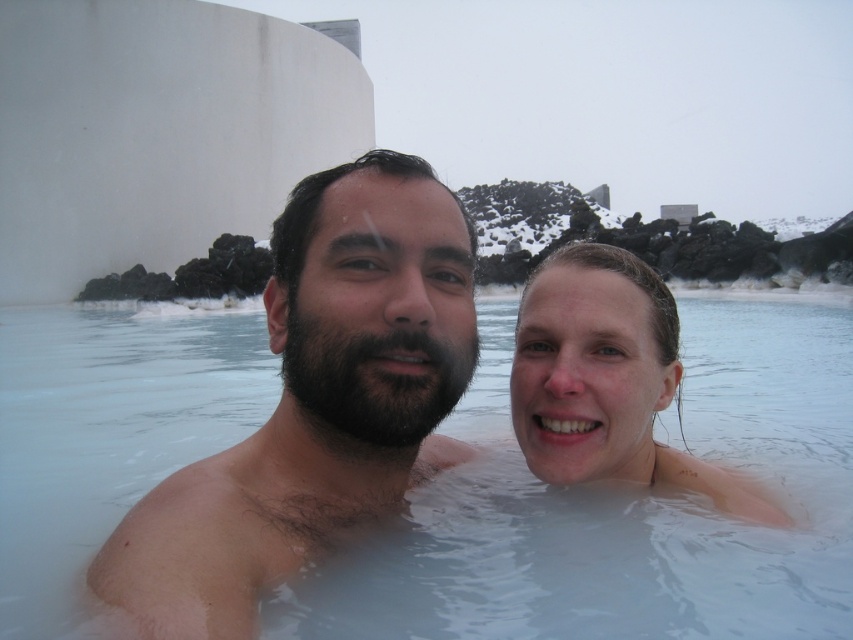
Can you confirm if clear water at center is wider than smooth skin man at center?

Indeed, clear water at center has a greater width compared to smooth skin man at center.

Who is more distant from viewer, (10, 476) or (456, 195)?

Point (10, 476)

The width and height of the screenshot is (853, 640). Find the location of `clear water at center`. clear water at center is located at coordinates (631, 516).

Consider the image. Who is positioned more to the left, clear water at center or smooth skin face at center?

clear water at center

Between clear water at center and smooth skin face at center, which one appears on the right side from the viewer's perspective?

Positioned to the right is smooth skin face at center.

Is point (456, 490) farther from camera compared to point (722, 474)?

That is True.

Where is `clear water at center`? The width and height of the screenshot is (853, 640). clear water at center is located at coordinates (631, 516).

Who is more forward, (252, 608) or (590, 358)?

Point (252, 608)

Is smooth skin man at center smaller than smooth skin face at center?

No.

Between point (285, 484) and point (598, 356), which one is positioned in front?

Positioned in front is point (285, 484).

Image resolution: width=853 pixels, height=640 pixels. In order to click on smooth skin man at center in this screenshot , I will do `click(316, 401)`.